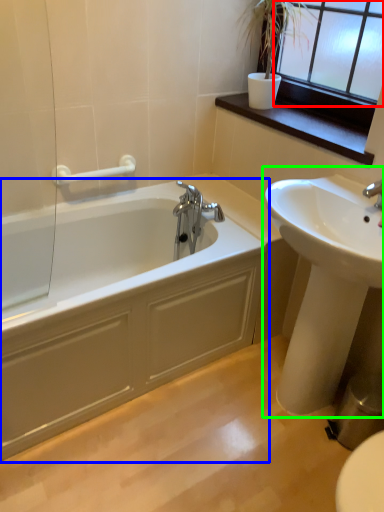
Question: Which is nearer to the window frame (highlighted by a red box)? bathtub (highlighted by a blue box) or sink (highlighted by a green box).

Choices:
 (A) bathtub
 (B) sink

Answer: (B)